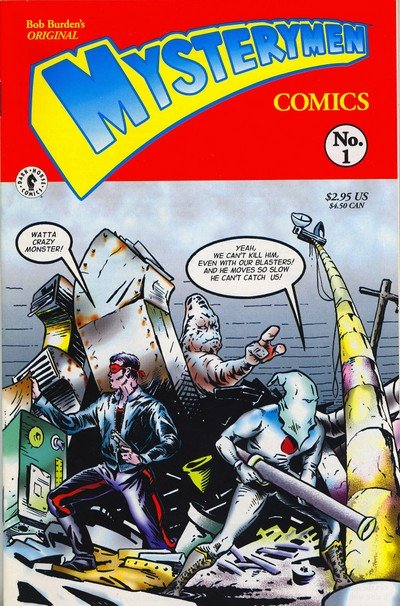
Locate an element on the screen. vent is located at coordinates (123, 302), (55, 311), (36, 376).